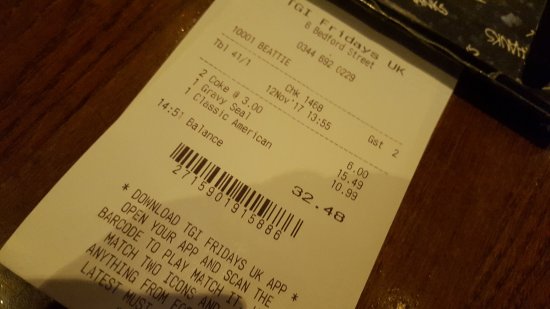
At what (x,y) coordinates should I click in order to perform the action: click on restaurant. Please return your answer as a coordinate pair (x, y). Image resolution: width=550 pixels, height=309 pixels. Looking at the image, I should click on (279, 119).